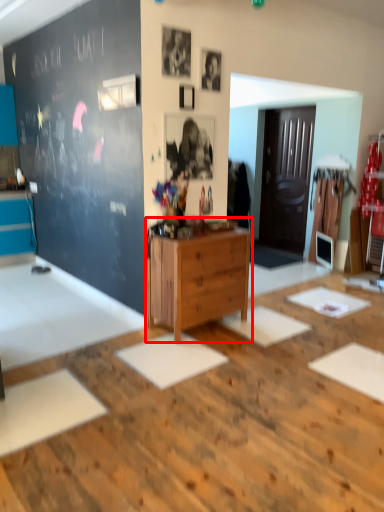
Question: From the image's perspective, what is the correct spatial positioning of chest of drawers (annotated by the red box) in reference to table?

Choices:
 (A) below
 (B) above

Answer: (B)